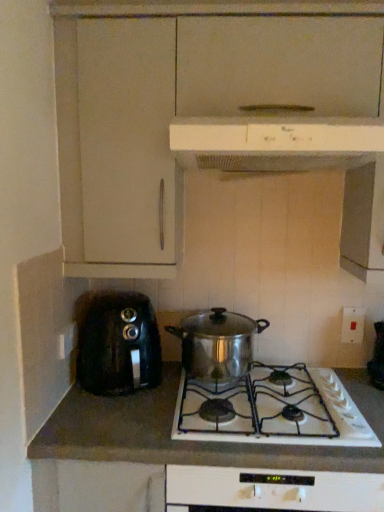
This screenshot has height=512, width=384. I want to click on free space on the front side of black plastic toaster at left, so click(x=105, y=422).